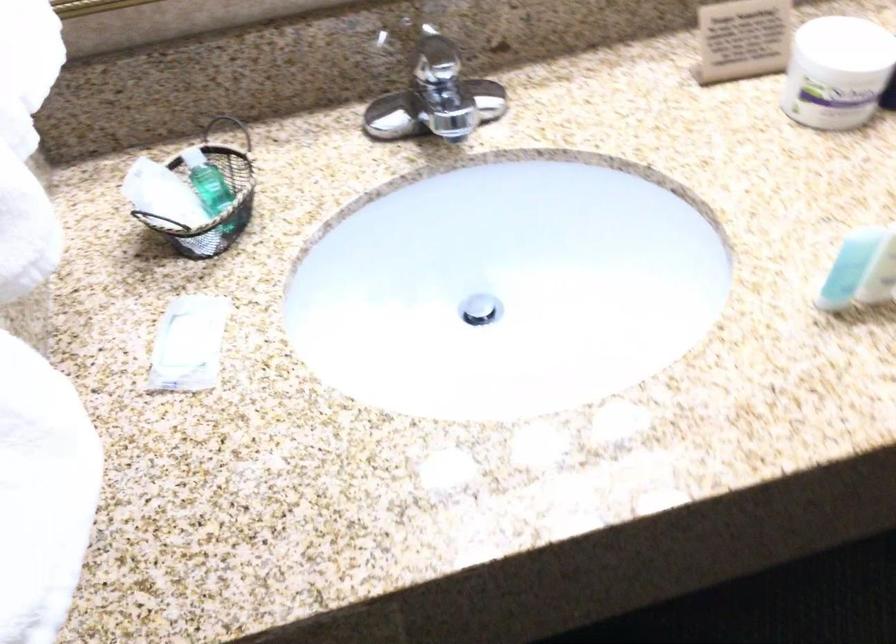
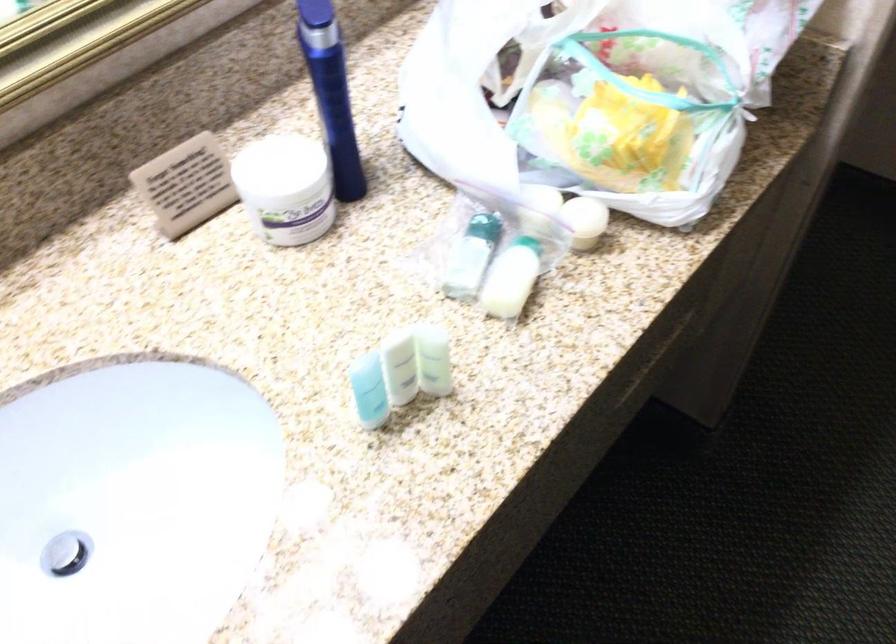
Where in the second image is the point corresponding to (x=480, y=306) from the first image?

(65, 554)